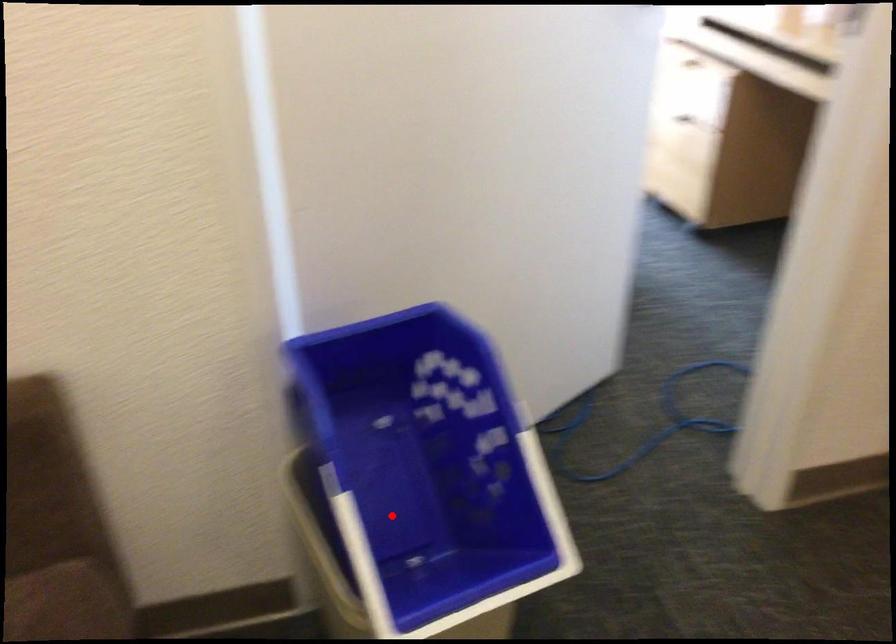
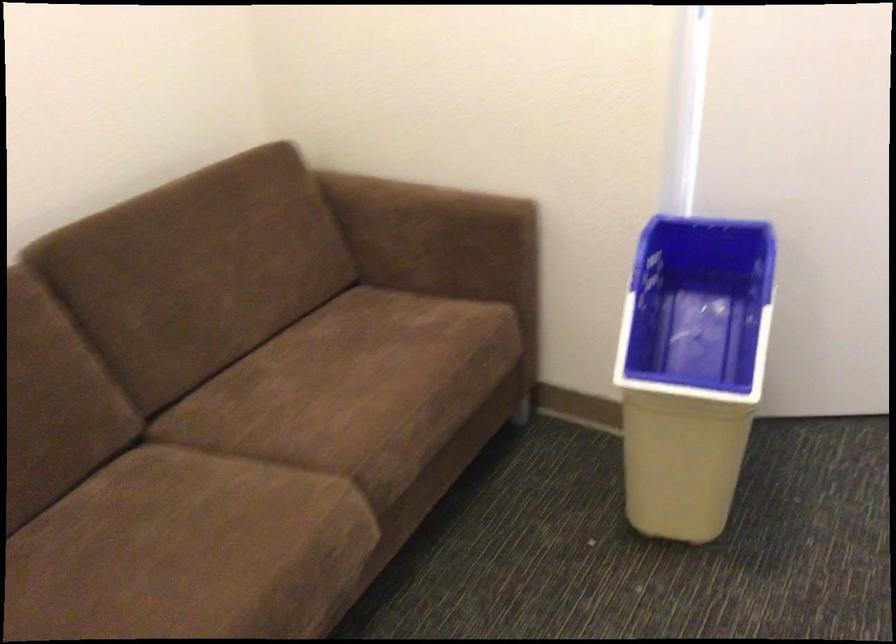
The point at the highlighted location is marked in the first image. Where is the corresponding point in the second image?

(692, 368)